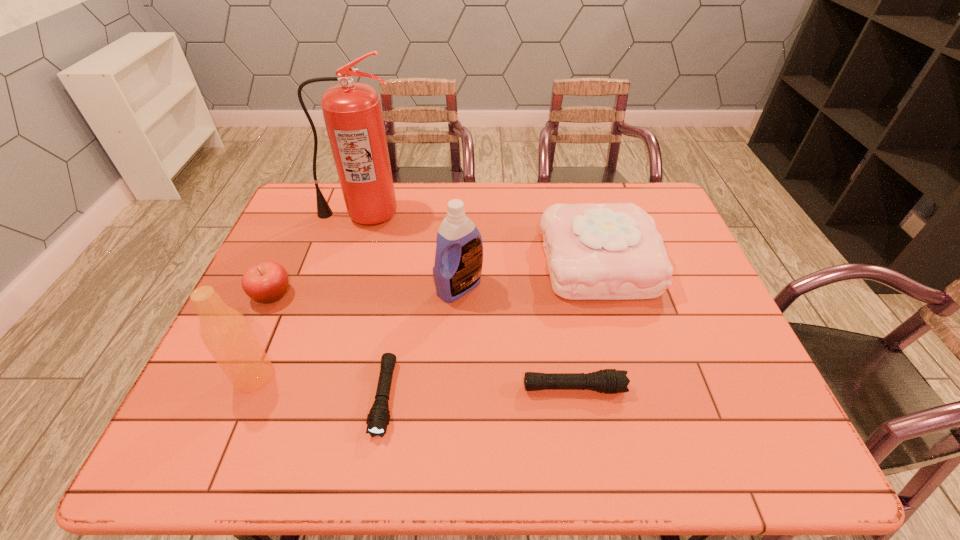
The width and height of the screenshot is (960, 540). I want to click on vacant space located 0.290m on the instruction side of the tallest object, so click(x=335, y=298).

Find the location of a particular element. vacant area situated 0.220m on the back of the fifth tallest object is located at coordinates (301, 230).

Find the location of a particular element. This screenshot has width=960, height=540. vacant area situated 0.250m on the back of the cake is located at coordinates (577, 183).

Where is `free space located 0.220m on the front of the third object from right to left`? free space located 0.220m on the front of the third object from right to left is located at coordinates (455, 376).

The image size is (960, 540). I want to click on free space located 0.300m on the back of the beer bottle, so click(x=299, y=272).

Locate an element on the screen. object located at the far edge is located at coordinates (352, 112).

At what (x,y) coordinates should I click in order to perform the action: click on beer bottle present at the near edge. Please return your answer as a coordinate pair (x, y). Looking at the image, I should click on (226, 333).

Where is `fire extinguisher at the left edge`? The image size is (960, 540). fire extinguisher at the left edge is located at coordinates (352, 112).

At what (x,y) coordinates should I click in order to perform the action: click on apple that is at the left edge. Please return your answer as a coordinate pair (x, y). This screenshot has height=540, width=960. Looking at the image, I should click on [265, 282].

You are a GUI agent. You are given a task and a screenshot of the screen. Output one action in this format:
    pyautogui.click(x=<x>, y=<y>)
    Task: Click on the beer bottle that is positioned at the left edge
    This screenshot has height=540, width=960.
    Given the screenshot: What is the action you would take?
    pyautogui.click(x=226, y=333)